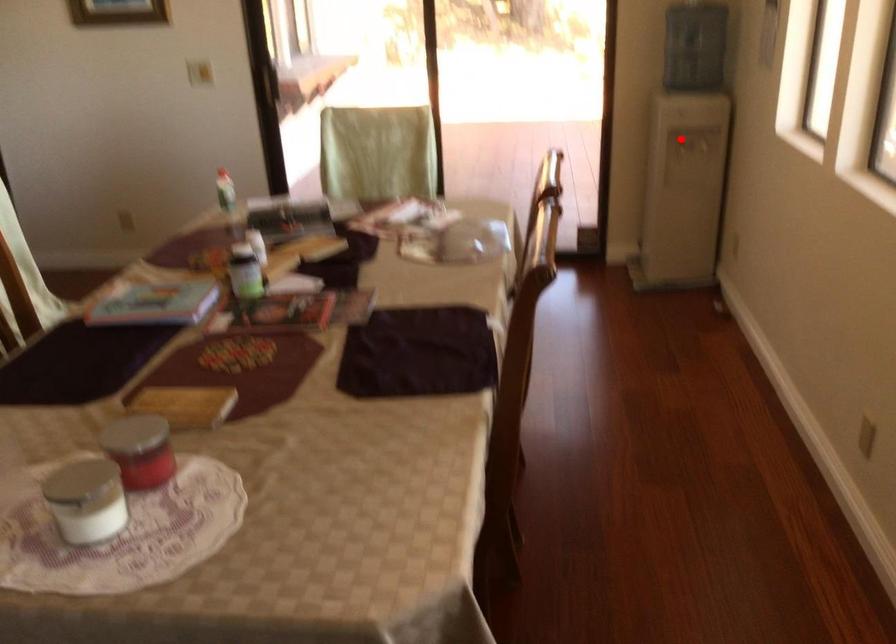
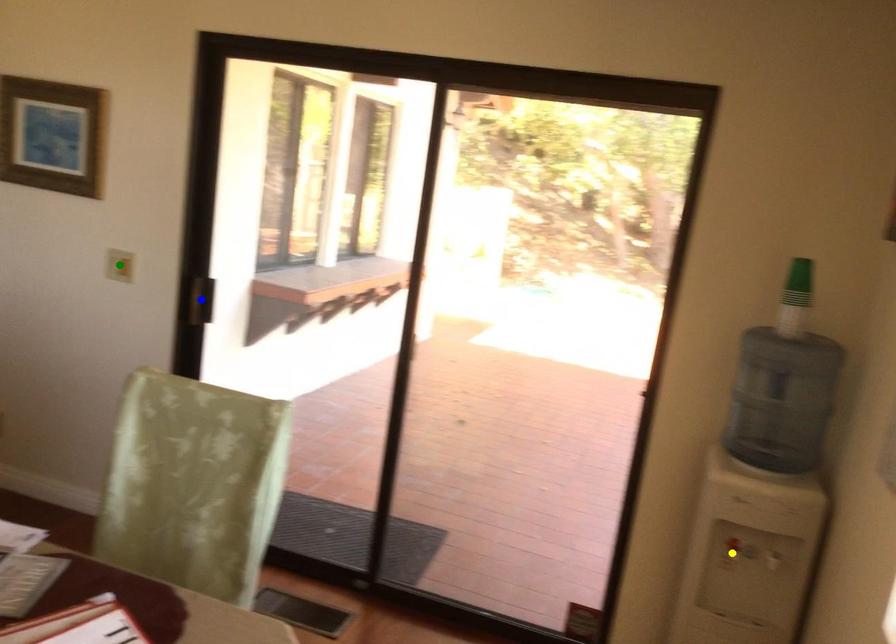
Question: I am providing you with two images of the same scene from different viewpoints. A red point is marked on the first image. You are given multiple points on the second image. Which mark in image 2 goes with the point in image 1?

Choices:
 (A) yellow point
 (B) green point
 (C) blue point

Answer: (A)